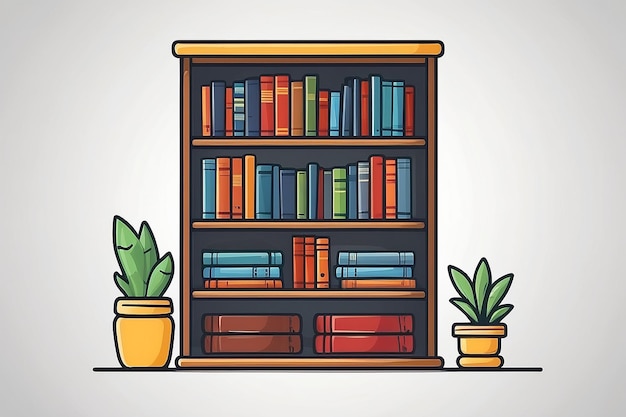
The height and width of the screenshot is (417, 626). I want to click on books on bottom shelf, so click(258, 323), click(258, 346), click(352, 317), click(355, 342).